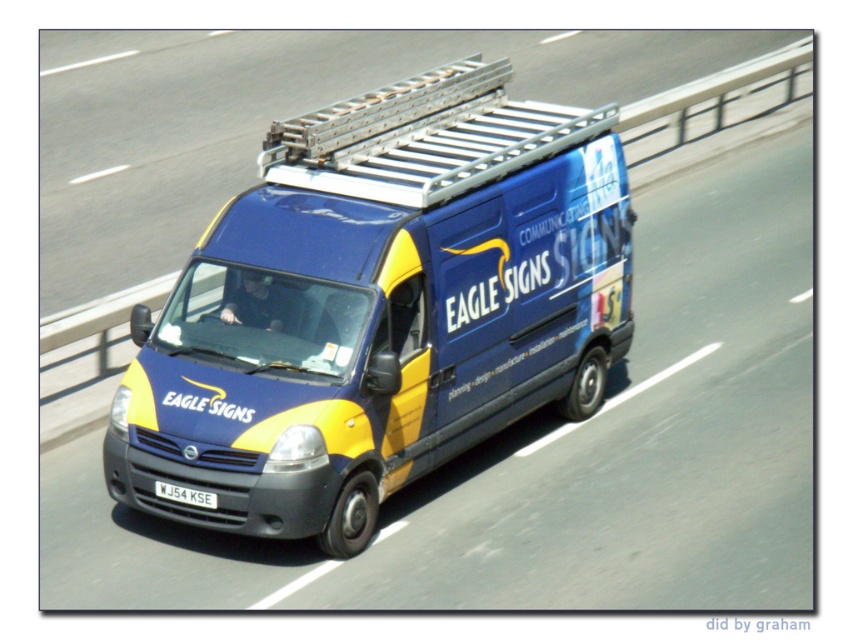
You are a traffic officer observing a vehicle on the highway. You notice the blue matte van at center and the white plastic license plate at center. Which object is wider?

The blue matte van at center is wider than the white plastic license plate at center.

You are a delivery driver who needs to park your vehicle precisely so that the license plate is visible to a camera mounted 6 feet above the ground. The camera has a field of view that can capture objects within 6 feet. Given the distance between the blue matte van at center and the white plastic license plate at center, will the license plate be within the camera view?

The distance between the blue matte van at center and the white plastic license plate at center is 5.85 feet, which is less than the camera field of view of 6 feet. Therefore, the white plastic license plate at center will be within the camera view.